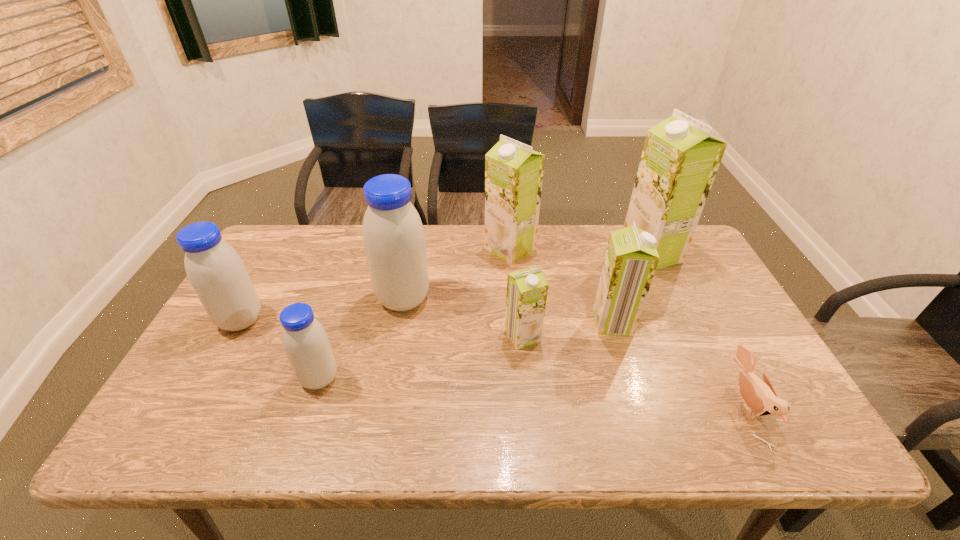
Where is `the sixth soya milk from right to left`? the sixth soya milk from right to left is located at coordinates (305, 341).

I want to click on the smallest green soya milk, so click(527, 289).

Where is `the shortest object`? the shortest object is located at coordinates (760, 397).

You are a GUI agent. You are given a task and a screenshot of the screen. Output one action in this format:
    pyautogui.click(x=<x>, y=<y>)
    Task: Click on the blank area located 0.260m on the front of the tallest soya milk
    The height and width of the screenshot is (540, 960).
    Given the screenshot: What is the action you would take?
    pyautogui.click(x=689, y=336)

Find the location of a particular element. The image size is (960, 540). blank space located 0.140m on the right of the third soya milk from left to right is located at coordinates (479, 299).

Where is `free space located on the front of the second biggest green soya milk`? The width and height of the screenshot is (960, 540). free space located on the front of the second biggest green soya milk is located at coordinates pos(518,346).

In order to click on free space located 0.330m on the back of the second smallest green soya milk in this screenshot , I will do `click(588, 240)`.

The width and height of the screenshot is (960, 540). In order to click on vacant space located 0.060m on the right of the leftmost object in this screenshot , I will do `click(286, 320)`.

Find the location of a particular element. vacant space situated 0.190m on the left of the nearest soya milk is located at coordinates (222, 378).

I want to click on free space located 0.200m on the right of the smallest green soya milk, so click(x=615, y=336).